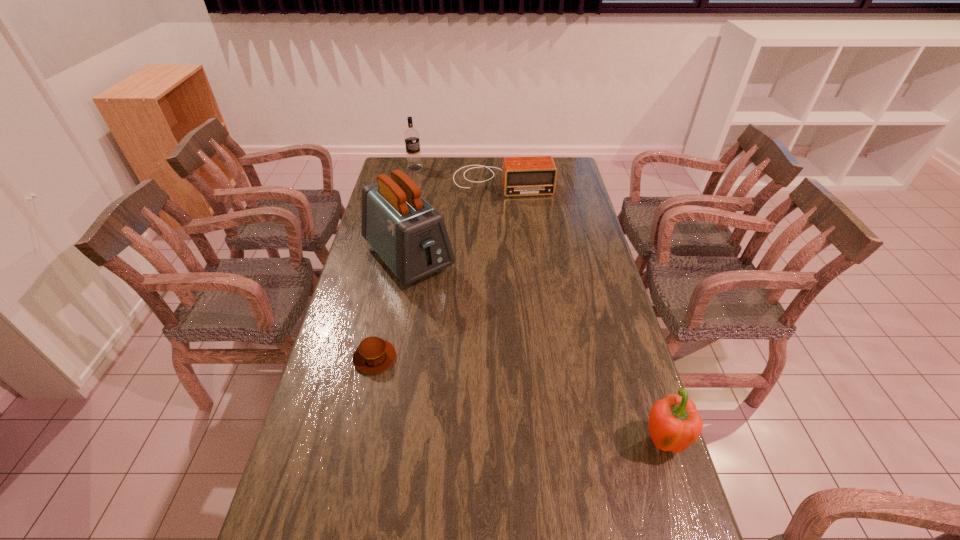
At what (x,y) coordinates should I click in order to perform the action: click on free space at the left edge of the desktop. Please return your answer as a coordinate pair (x, y). The height and width of the screenshot is (540, 960). Looking at the image, I should click on (309, 421).

In the image, there is a desktop. At what (x,y) coordinates should I click in order to perform the action: click on vacant space at the right edge. Please return your answer as a coordinate pair (x, y). The image size is (960, 540). Looking at the image, I should click on (561, 260).

You are a GUI agent. You are given a task and a screenshot of the screen. Output one action in this format:
    pyautogui.click(x=<x>, y=<y>)
    Task: Click on the vacant space at the far left corner of the desktop
    Image resolution: width=960 pixels, height=540 pixels.
    Given the screenshot: What is the action you would take?
    pyautogui.click(x=397, y=167)

This screenshot has width=960, height=540. Identify the location of vacant area at the far right corner. pyautogui.click(x=567, y=175).

Where is `vacant space at the near right corner`? The height and width of the screenshot is (540, 960). vacant space at the near right corner is located at coordinates (630, 516).

This screenshot has height=540, width=960. In order to click on empty space between the rightmost object and the vodka in this screenshot , I will do `click(539, 305)`.

Where is `free space that is in between the vodka and the pepper`? Image resolution: width=960 pixels, height=540 pixels. free space that is in between the vodka and the pepper is located at coordinates (539, 305).

Identify the location of free space that is in between the fourth shortest object and the third shortest object. (539, 305).

At what (x,y) coordinates should I click in order to perform the action: click on vacant area between the tallest object and the radio receiver. Please return your answer as a coordinate pair (x, y). Looking at the image, I should click on (455, 220).

You are a GUI agent. You are given a task and a screenshot of the screen. Output one action in this format:
    pyautogui.click(x=<x>, y=<y>)
    Task: Click on the free space between the tallest object and the second shortest object
    
    Given the screenshot: What is the action you would take?
    pyautogui.click(x=455, y=220)